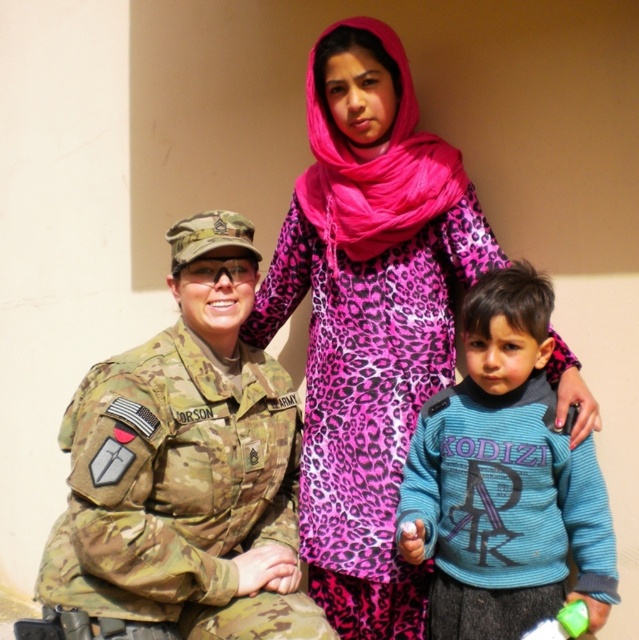
You are a photographer adjusting your camera settings. You need to focus on the pink leopard print dress at center. Where should you direct your camera to ensure proper focus?

The pink leopard print dress at center is located at point [367,316], so you should direct your camera to that coordinate to ensure proper focus.

Based on the photo, you are a photographer trying to capture a clear shot of the blue fleece sweater at center and the camo fabric uniform at left. Since the camera can only focus on one subject at a time, which one should you focus on to ensure the other is still somewhat in focus?

The blue fleece sweater at center is behind the camo fabric uniform at left. Therefore, focusing on the camo fabric uniform at left will keep the blue fleece sweater at center in better focus as it is closer to the camera.

You are a photographer taking a picture of these three people. You notice the pink leopard print dress at center and the camo fabric uniform at left. Which one is closer to your camera?

The pink leopard print dress at center is closer to the camera because it is further to the viewer than the camo fabric uniform at left.